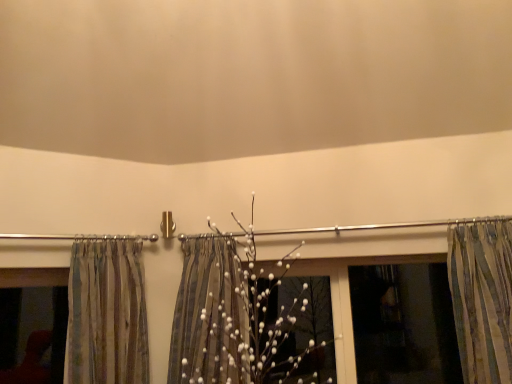
Question: Considering the relative sizes of striped fabric curtain at right, the 2th curtain in the left-to-right sequence, and transparent plastic window screen at right in the image provided, is striped fabric curtain at right, the 2th curtain in the left-to-right sequence, wider than transparent plastic window screen at right?

Choices:
 (A) yes
 (B) no

Answer: (A)

Question: Can you confirm if striped fabric curtain at right, which is the 1th curtain from right to left, is bigger than transparent plastic window screen at right?

Choices:
 (A) yes
 (B) no

Answer: (A)

Question: Is striped fabric curtain at right, the 2th curtain in the left-to-right sequence, further to camera compared to transparent plastic window screen at right?

Choices:
 (A) no
 (B) yes

Answer: (A)

Question: Is striped fabric curtain at right, which is the 1th curtain from right to left, far from transparent plastic window screen at right?

Choices:
 (A) yes
 (B) no

Answer: (B)

Question: Could transparent plastic window screen at right be considered to be inside striped fabric curtain at right, the 2th curtain in the left-to-right sequence?

Choices:
 (A) yes
 (B) no

Answer: (B)

Question: Is striped fabric curtain at right, which is the 1th curtain from right to left, positioned with its back to transparent plastic window screen at right?

Choices:
 (A) no
 (B) yes

Answer: (A)

Question: Can you confirm if striped fabric curtain at right, which is the 1th curtain from right to left, is shorter than striped fabric curtain at left, marked as the 1th curtain in a left-to-right arrangement?

Choices:
 (A) yes
 (B) no

Answer: (A)

Question: Is striped fabric curtain at right, the 2th curtain in the left-to-right sequence, to the right of striped fabric curtain at left, the 2th curtain from the right, from the viewer's perspective?

Choices:
 (A) no
 (B) yes

Answer: (B)

Question: From a real-world perspective, is striped fabric curtain at right, the 2th curtain in the left-to-right sequence, beneath striped fabric curtain at left, the 2th curtain from the right?

Choices:
 (A) yes
 (B) no

Answer: (A)

Question: From the image's perspective, is striped fabric curtain at right, the 2th curtain in the left-to-right sequence, below striped fabric curtain at left, marked as the 1th curtain in a left-to-right arrangement?

Choices:
 (A) no
 (B) yes

Answer: (A)

Question: Would you say striped fabric curtain at right, the 2th curtain in the left-to-right sequence, is outside striped fabric curtain at left, marked as the 1th curtain in a left-to-right arrangement?

Choices:
 (A) yes
 (B) no

Answer: (A)

Question: Are striped fabric curtain at right, the 2th curtain in the left-to-right sequence, and striped fabric curtain at left, the 2th curtain from the right, far apart?

Choices:
 (A) yes
 (B) no

Answer: (A)

Question: Is transparent plastic window screen at right positioned in front of matte glass window at left?

Choices:
 (A) yes
 (B) no

Answer: (B)